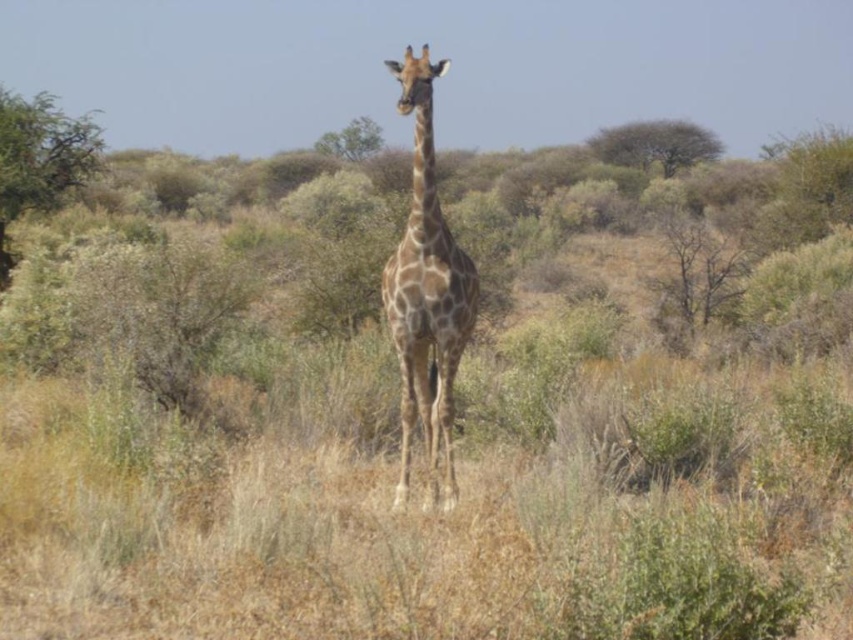
Who is taller, spotted fur giraffe at center or brown textured tree at upper center?

spotted fur giraffe at center

What do you see at coordinates (426, 288) in the screenshot?
I see `spotted fur giraffe at center` at bounding box center [426, 288].

Is point (421, 124) positioned after point (686, 160)?

No, (421, 124) is closer to viewer.

At what (x,y) coordinates should I click in order to perform the action: click on spotted fur giraffe at center. Please return your answer as a coordinate pair (x, y). Looking at the image, I should click on (426, 288).

In the scene shown: Does spotted fur giraffe at center appear under green leafy tree at center?

Yes, spotted fur giraffe at center is below green leafy tree at center.

Which of these two, spotted fur giraffe at center or green leafy tree at center, stands shorter?

Standing shorter between the two is spotted fur giraffe at center.

Who is more forward, (422, 220) or (343, 144)?

Point (422, 220)

At what (x,y) coordinates should I click in order to perform the action: click on spotted fur giraffe at center. Please return your answer as a coordinate pair (x, y). Looking at the image, I should click on (426, 288).

Which is above, green leafy shrub at left or brown textured tree at upper center?

Positioned higher is green leafy shrub at left.

Does green leafy shrub at left have a lesser width compared to brown textured tree at upper center?

No.

The height and width of the screenshot is (640, 853). Find the location of `green leafy shrub at left`. green leafy shrub at left is located at coordinates (39, 157).